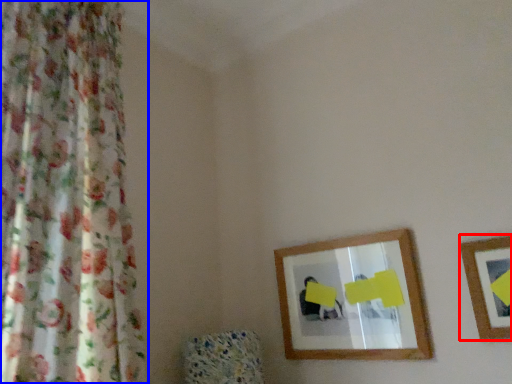
Question: Which object appears farthest to the camera in this image, picture frame (highlighted by a red box) or curtain (highlighted by a blue box)?

Choices:
 (A) picture frame
 (B) curtain

Answer: (A)